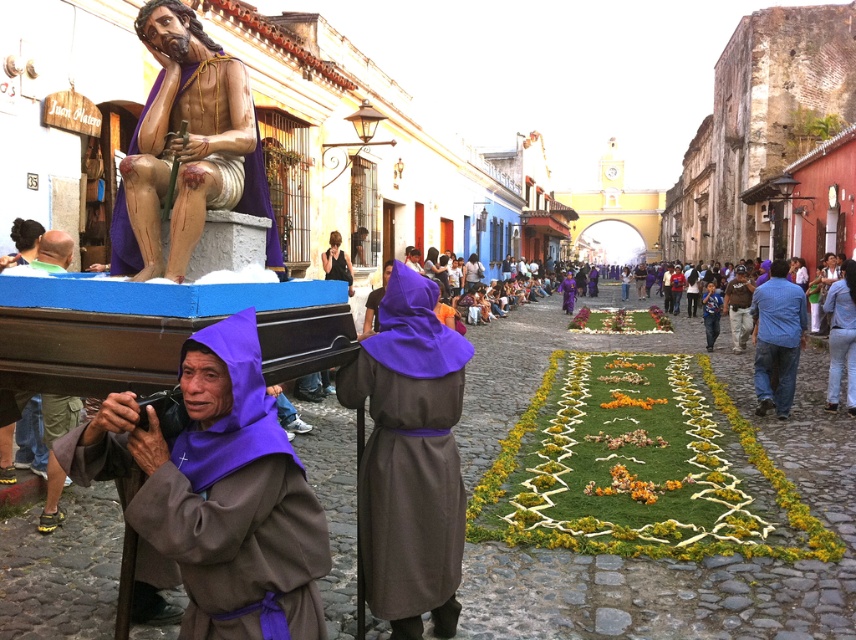
Question: Based on their relative distances, which object is farther from the matte black shirt at center?

Choices:
 (A) brown leather jacket at center
 (B) purple fabric statue at center

Answer: (A)

Question: Which point is farther from the camera taking this photo?

Choices:
 (A) (709, 314)
 (B) (729, 284)
 (C) (233, 595)
 (D) (414, 492)

Answer: (A)

Question: Can you confirm if blue denim jeans at lower right is wider than blue jeans at lower right?

Choices:
 (A) no
 (B) yes

Answer: (A)

Question: Can you confirm if blue jeans at lower right is positioned below brown leather jacket at center?

Choices:
 (A) no
 (B) yes

Answer: (B)

Question: Considering the real-world distances, which object is closest to the matte black shirt at center?

Choices:
 (A) brown leather jacket at center
 (B) blue denim jeans at lower right

Answer: (B)

Question: Is purple woolen robe at lower left to the right of matte black shirt at center from the viewer's perspective?

Choices:
 (A) no
 (B) yes

Answer: (B)